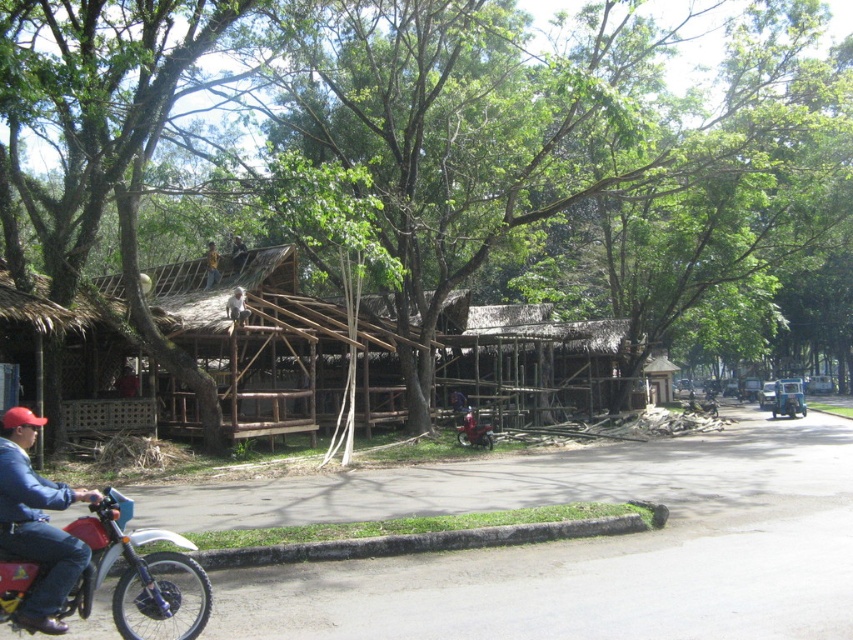
Consider the image. Between red matte motorcycle at lower left and denim jacket at lower left, which one is positioned higher?

Positioned higher is denim jacket at lower left.

Can you confirm if red matte motorcycle at lower left is bigger than denim jacket at lower left?

Indeed, red matte motorcycle at lower left has a larger size compared to denim jacket at lower left.

At what (x,y) coordinates should I click in order to perform the action: click on red matte motorcycle at lower left. Please return your answer as a coordinate pair (x, y). The width and height of the screenshot is (853, 640). Looking at the image, I should click on (132, 568).

Does red matte motorcycle at lower left appear under red matte motorcycle at center?

Incorrect, red matte motorcycle at lower left is not positioned below red matte motorcycle at center.

Who is taller, red matte motorcycle at lower left or red matte motorcycle at center?

Standing taller between the two is red matte motorcycle at lower left.

You are a GUI agent. You are given a task and a screenshot of the screen. Output one action in this format:
    pyautogui.click(x=<x>, y=<y>)
    Task: Click on the red matte motorcycle at lower left
    
    Given the screenshot: What is the action you would take?
    pyautogui.click(x=132, y=568)

How far apart are green leafy tree at center and red matte motorcycle at lower left?

A distance of 73.89 feet exists between green leafy tree at center and red matte motorcycle at lower left.

Is green leafy tree at center thinner than red matte motorcycle at lower left?

No.

Is point (740, 276) positioned behind point (80, 588)?

Yes, point (740, 276) is farther from viewer.

Locate an element on the screen. green leafy tree at center is located at coordinates (440, 147).